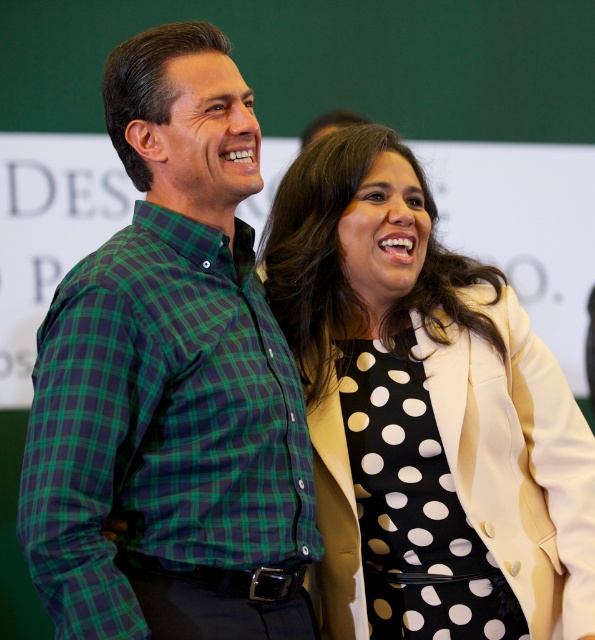
You are a photographer who wants to ensure both the green plaid shirt at center and the white dotted dress at center are clearly visible in the photo. Given their sizes, which one might you need to adjust your camera focus on to ensure it appears larger in the final image?

The green plaid shirt at center is smaller than the white dotted dress at center. To ensure both are clearly visible, you might need to adjust the camera focus to make the green plaid shirt at center appear larger in the image.

You are a photographer standing 10 feet away from the two people in the image. You want to capture a photo where both the green plaid shirt at center and the white dotted dress at center are in focus. Given that your camera can focus on objects within a 10 inch range, will both subjects be in focus?

The green plaid shirt at center is 12.88 inches from the white dotted dress at center. Since the camera can only focus within a 10 inch range, the distance between them exceeds this limit. Therefore, both subjects cannot be in focus simultaneously.

You are taking a photo of two people standing in front of a green wall. You notice two points in the image labeled as point (x=60, y=376) and point (x=400, y=220). Which of these points is nearer to the camera?

Point (x=60, y=376) is closer to the camera than point (x=400, y=220).